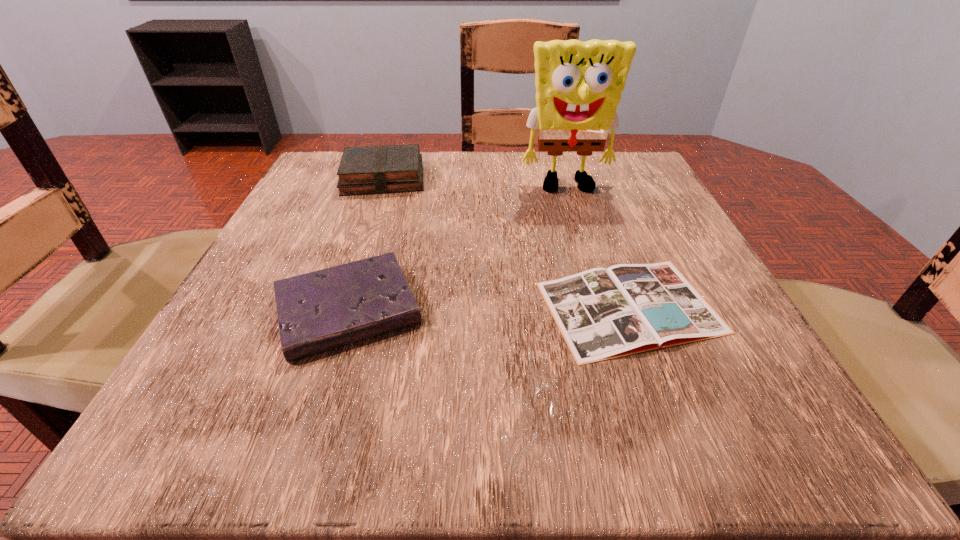
At what (x,y) coordinates should I click in order to perform the action: click on sponge at the far edge. Please return your answer as a coordinate pair (x, y). The image size is (960, 540). Looking at the image, I should click on click(x=578, y=84).

The width and height of the screenshot is (960, 540). Identify the location of book that is at the far edge. (382, 169).

Where is `book at the left edge`? The height and width of the screenshot is (540, 960). book at the left edge is located at coordinates (382, 169).

Identify the location of diary that is at the left edge. Image resolution: width=960 pixels, height=540 pixels. (318, 311).

Where is `sponge present at the right edge`? The height and width of the screenshot is (540, 960). sponge present at the right edge is located at coordinates (578, 84).

Find the location of a particular element. The width and height of the screenshot is (960, 540). book that is at the right edge is located at coordinates (602, 314).

Locate an element on the screen. This screenshot has width=960, height=540. object located at the far left corner is located at coordinates (382, 169).

You are a GUI agent. You are given a task and a screenshot of the screen. Output one action in this format:
    pyautogui.click(x=<x>, y=<y>)
    Task: Click on the object that is at the far right corner
    The height and width of the screenshot is (540, 960).
    Given the screenshot: What is the action you would take?
    pyautogui.click(x=578, y=84)

This screenshot has height=540, width=960. I want to click on free space at the far edge of the desktop, so click(x=411, y=195).

In the image, there is a desktop. Where is `vacant space at the near edge`? vacant space at the near edge is located at coordinates (333, 437).